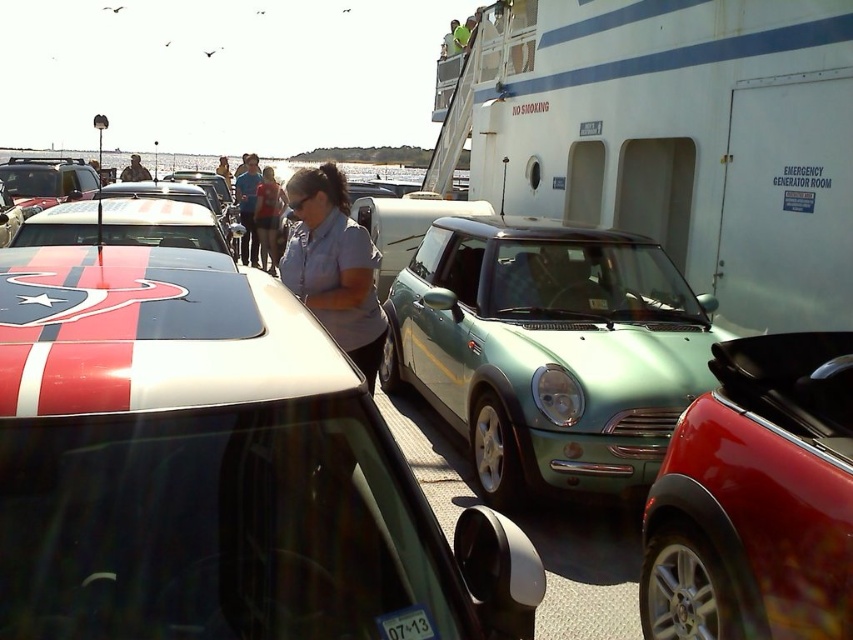
Does blue cotton shirt at center appear on the left side of denim jacket at center?

No, blue cotton shirt at center is not to the left of denim jacket at center.

Does blue cotton shirt at center have a larger size compared to denim jacket at center?

Incorrect, blue cotton shirt at center is not larger than denim jacket at center.

This screenshot has width=853, height=640. In order to click on blue cotton shirt at center in this screenshot , I will do `click(334, 266)`.

Locate an element on the screen. This screenshot has width=853, height=640. blue cotton shirt at center is located at coordinates (334, 266).

Is blue cotton shirt at center below blue denim shirt at center?

Yes, blue cotton shirt at center is below blue denim shirt at center.

Between blue cotton shirt at center and blue denim shirt at center, which one appears on the right side from the viewer's perspective?

blue cotton shirt at center is more to the right.

Which is in front, point (345, 272) or point (236, 180)?

Point (345, 272) is in front.

At what (x,y) coordinates should I click in order to perform the action: click on blue cotton shirt at center. Please return your answer as a coordinate pair (x, y). Looking at the image, I should click on click(334, 266).

Does shiny red convertible at center appear on the right side of denim shirt at center?

Yes, shiny red convertible at center is to the right of denim shirt at center.

The width and height of the screenshot is (853, 640). I want to click on shiny red convertible at center, so click(756, 499).

Find the location of a particular element. The image size is (853, 640). shiny red convertible at center is located at coordinates (756, 499).